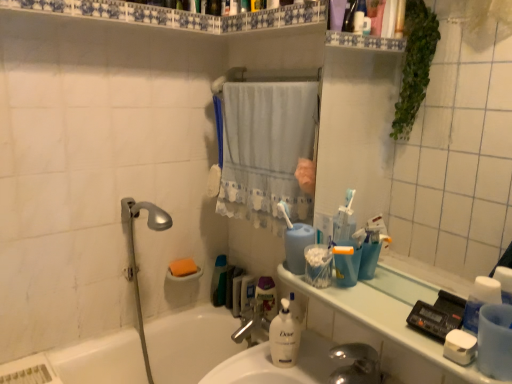
This screenshot has width=512, height=384. Find the location of `free location in front of transparent plastic mirror at upper right`. free location in front of transparent plastic mirror at upper right is located at coordinates (399, 321).